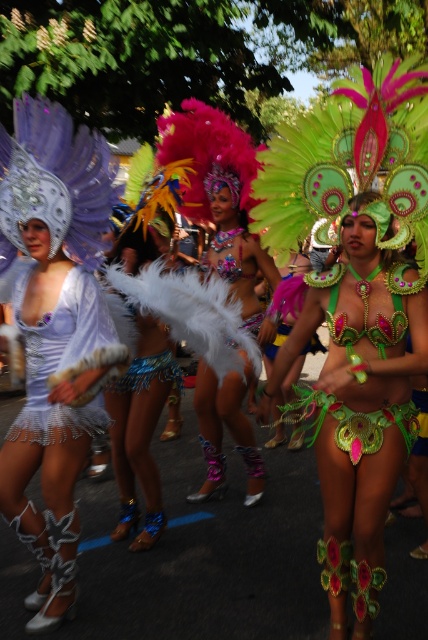
Which of these two, matte white feathers at left or matte white feathered skirt at left, stands taller?

Standing taller between the two is matte white feathers at left.

Which is below, matte white feathers at left or matte white feathered skirt at left?

matte white feathers at left is below.

Who is more distant from viewer, (86, 148) or (70, 346)?

The point (86, 148) is more distant.

The height and width of the screenshot is (640, 428). What are the coordinates of `matte white feathers at left` in the screenshot? It's located at (55, 332).

Is green sequined bikini at center closer to camera compared to matte white feathered skirt at left?

Yes, green sequined bikini at center is closer to the viewer.

Where is `green sequined bikini at center`? green sequined bikini at center is located at coordinates (357, 410).

Locate an element on the screen. green sequined bikini at center is located at coordinates (357, 410).

Is the position of matte white feathers at left more distant than that of shiny silver headdress at center?

That is False.

Which is behind, point (59, 515) or point (249, 312)?

Positioned behind is point (249, 312).

Is point (53, 262) positioned before point (216, 260)?

Yes, it is.

What are the coordinates of `matte white feathers at left` in the screenshot? It's located at tap(55, 332).